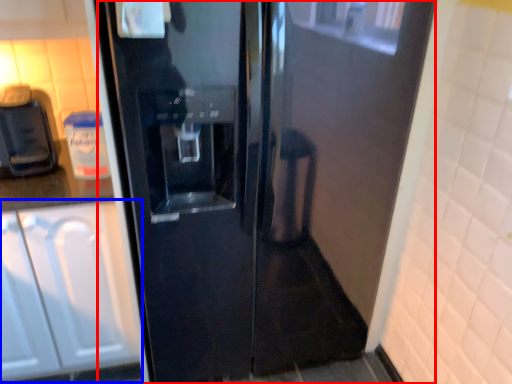
Question: Which object appears closest to the camera in this image, door (highlighted by a red box) or cabinetry (highlighted by a blue box)?

Choices:
 (A) door
 (B) cabinetry

Answer: (A)